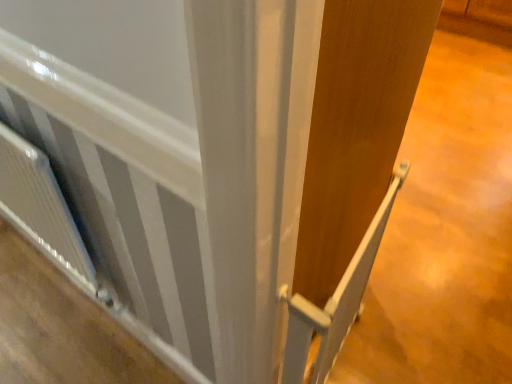
Question: In terms of height, does white glossy radiator at lower left look taller or shorter compared to white textured radiator at lower left?

Choices:
 (A) tall
 (B) short

Answer: (B)

Question: Visually, is white glossy radiator at lower left positioned to the left or to the right of white textured radiator at lower left?

Choices:
 (A) right
 (B) left

Answer: (A)

Question: Estimate the real-world distances between objects in this image. Which object is farther from the white plastic rail at center?

Choices:
 (A) white textured radiator at lower left
 (B) white glossy radiator at lower left

Answer: (B)

Question: Estimate the real-world distances between objects in this image. Which object is closer to the white textured radiator at lower left?

Choices:
 (A) white glossy radiator at lower left
 (B) white plastic rail at center

Answer: (A)